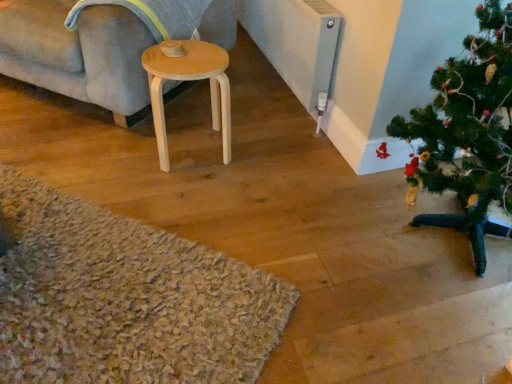
What are the coordinates of `free space underneath green matte christmas tree at lower right (from a real-world perspective)` in the screenshot? It's located at (447, 246).